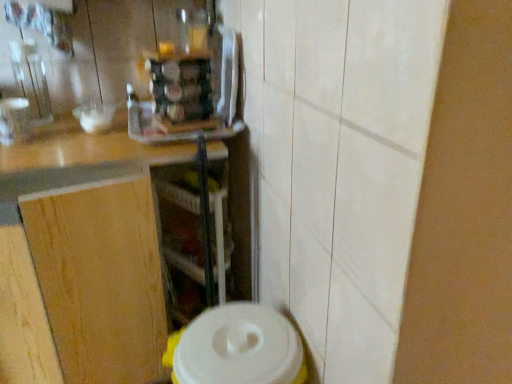
This screenshot has height=384, width=512. I want to click on transparent plastic shelf at center, so click(180, 221).

What do you see at coordinates (180, 221) in the screenshot? I see `transparent plastic shelf at center` at bounding box center [180, 221].

Find the location of a particular element. The image size is (512, 384). wooden at left is located at coordinates (81, 258).

You are a GUI agent. You are given a task and a screenshot of the screen. Output one action in this format:
    pyautogui.click(x=<x>, y=<y>)
    Task: Click on the transparent plastic shelf at center
    
    Given the screenshot: What is the action you would take?
    pyautogui.click(x=180, y=221)

From the picture: From a real-world perspective, which is physically below, wooden at left or transparent plastic shelf at center?

transparent plastic shelf at center is physically lower.

Can you tell me how much wooden at left and transparent plastic shelf at center differ in facing direction?

wooden at left and transparent plastic shelf at center are facing 61.1 degrees away from each other.

Is wooden at left with transparent plastic shelf at center?

They are not placed beside each other.

Which of these two, wooden at left or transparent plastic shelf at center, stands shorter?

Standing shorter between the two is transparent plastic shelf at center.

Is white plastic container at lower center turned away from wooden at left?

white plastic container at lower center does not have its back to wooden at left.

From the image's perspective, is white plastic container at lower center beneath wooden at left?

Indeed, from the image's perspective, white plastic container at lower center is shown beneath wooden at left.

Looking at this image, which object is further away from the camera, white plastic container at lower center or wooden at left?

wooden at left is more distant.

Can you confirm if white plastic container at lower center is bigger than wooden at left?

No.

From the image's perspective, is wooden at left positioned above or below white plastic container at lower center?

wooden at left is above white plastic container at lower center.

Is point (41, 225) less distant than point (173, 352)?

That is False.

Is wooden at left facing away from white plastic container at lower center?

No, wooden at left is not facing the opposite direction of white plastic container at lower center.

The height and width of the screenshot is (384, 512). I want to click on shelf that appears below the wooden at left (from a real-world perspective), so click(x=180, y=221).

What's the angular difference between transparent plastic shelf at center and wooden at left's facing directions?

The angle between the facing direction of transparent plastic shelf at center and the facing direction of wooden at left is 61.1 degrees.

Can you confirm if transparent plastic shelf at center is taller than wooden at left?

No, transparent plastic shelf at center is not taller than wooden at left.

Is transparent plastic shelf at center looking in the opposite direction of wooden at left?

Absolutely, transparent plastic shelf at center is directed away from wooden at left.

Is white plastic container at lower center to the left of transparent plastic shelf at center from the viewer's perspective?

Incorrect, white plastic container at lower center is not on the left side of transparent plastic shelf at center.

Is white plastic container at lower center smaller than transparent plastic shelf at center?

Incorrect, white plastic container at lower center is not smaller in size than transparent plastic shelf at center.

Which is in front, point (245, 349) or point (201, 250)?

The point (245, 349) is in front.

Can you confirm if white plastic container at lower center is wider than transparent plastic shelf at center?

Yes, white plastic container at lower center is wider than transparent plastic shelf at center.

In the scene shown: Between transparent plastic shelf at center and white plastic container at lower center, which one appears on the right side from the viewer's perspective?

From the viewer's perspective, white plastic container at lower center appears more on the right side.

Can you confirm if transparent plastic shelf at center is wider than white plastic container at lower center?

Incorrect, the width of transparent plastic shelf at center does not surpass that of white plastic container at lower center.

Is point (217, 227) positioned before point (247, 362)?

No, it is not.

From the image's perspective, which is below, transparent plastic shelf at center or white plastic container at lower center?

white plastic container at lower center.

You are a GUI agent. You are given a task and a screenshot of the screen. Output one action in this format:
    pyautogui.click(x=<x>, y=<y>)
    Task: Click on the countertop above the transparent plastic shelf at center (from the image's perspective)
    This screenshot has height=384, width=512.
    Given the screenshot: What is the action you would take?
    pyautogui.click(x=81, y=258)

Find the location of a particular element. This screenshot has width=512, height=384. countertop behind the white plastic container at lower center is located at coordinates (81, 258).

Considering their positions, is white plastic container at lower center positioned further to wooden at left than transparent plastic shelf at center?

white plastic container at lower center is positioned further to the anchor wooden at left.

When comparing their distances from transparent plastic shelf at center, does white plastic container at lower center or wooden at left seem closer?

wooden at left is closer to transparent plastic shelf at center.

From the image, which object appears to be nearer to white plastic container at lower center, wooden at left or transparent plastic shelf at center?

wooden at left is positioned closer to the anchor white plastic container at lower center.

Based on their spatial positions, is transparent plastic shelf at center or white plastic container at lower center further from wooden at left?

white plastic container at lower center is further to wooden at left.

Estimate the real-world distances between objects in this image. Which object is closer to white plastic container at lower center, transparent plastic shelf at center or wooden at left?

Based on the image, wooden at left appears to be nearer to white plastic container at lower center.

Which object lies nearer to the anchor point transparent plastic shelf at center, wooden at left or white plastic container at lower center?

Based on the image, wooden at left appears to be nearer to transparent plastic shelf at center.

What are the coordinates of `countertop between white plastic container at lower center and transparent plastic shelf at center along the z-axis` in the screenshot? It's located at (81, 258).